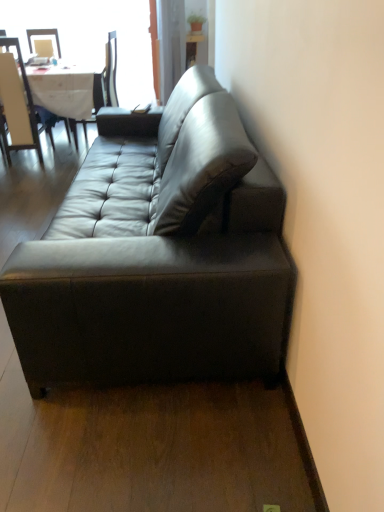
Question: Is white cloth table at upper left taller or shorter than matte black chair at upper left, the first chair viewed from the right?

Choices:
 (A) tall
 (B) short

Answer: (B)

Question: Considering the positions of white cloth table at upper left and matte black chair at upper left, the first chair viewed from the right, in the image, is white cloth table at upper left wider or thinner than matte black chair at upper left, the first chair viewed from the right,?

Choices:
 (A) thin
 (B) wide

Answer: (B)

Question: Which is farther from the transparent glass window at upper left?

Choices:
 (A) white cloth table at upper left
 (B) light beige wood chair at upper left, which is the second chair from right to left
 (C) matte black couch at center
 (D) matte black chair at upper left, the first chair viewed from the right

Answer: (C)

Question: Which of these objects is positioned closest to the matte black couch at center?

Choices:
 (A) white cloth table at upper left
 (B) transparent glass window at upper left
 (C) light beige wood chair at upper left, the first chair viewed from the left
 (D) matte black chair at upper left, the first chair viewed from the right

Answer: (A)